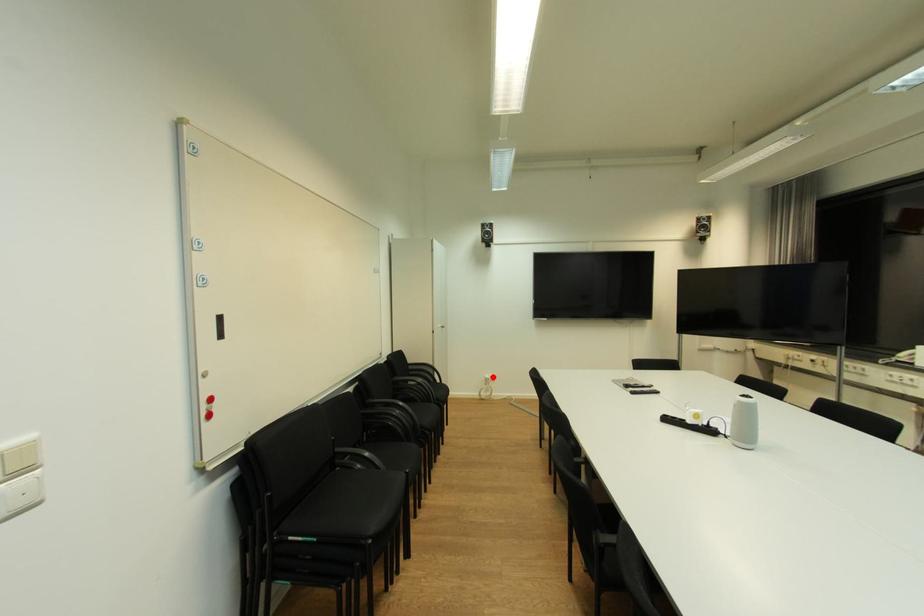
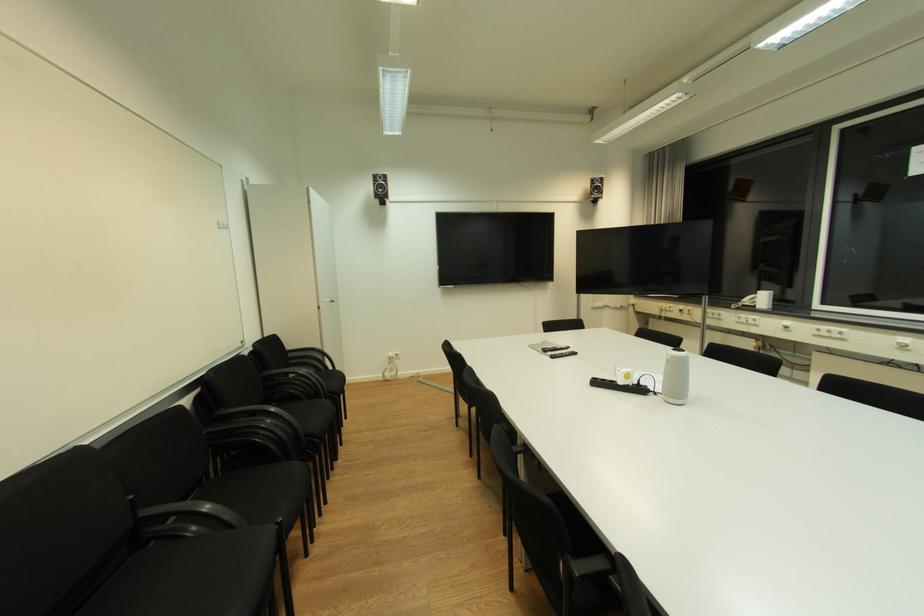
Question: I am providing you with two images of the same scene from different viewpoints. Image1 has a red point marked. In image2, the corresponding 3D location appears at what relative position? Reply with the corresponding letter.

Choices:
 (A) Closer
 (B) Farther

Answer: (A)